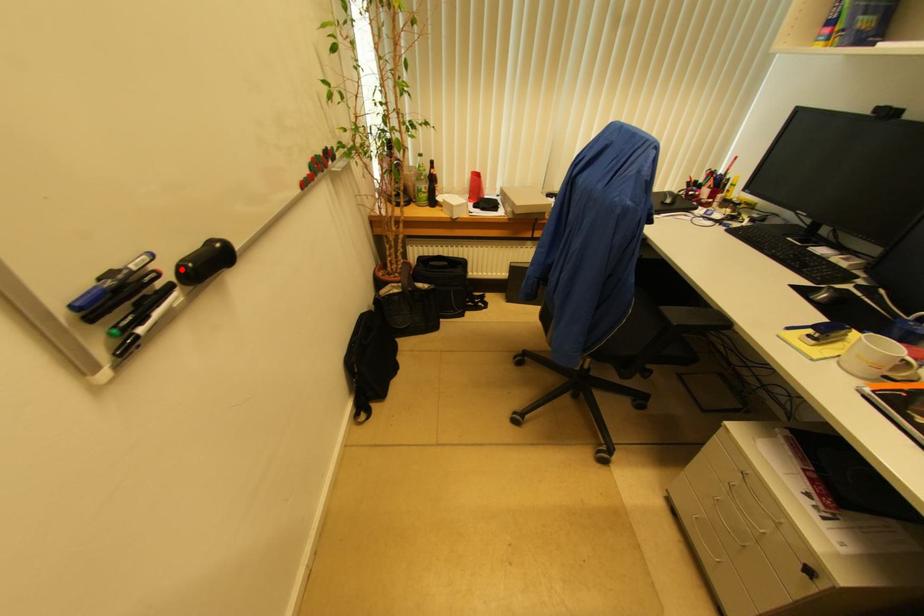
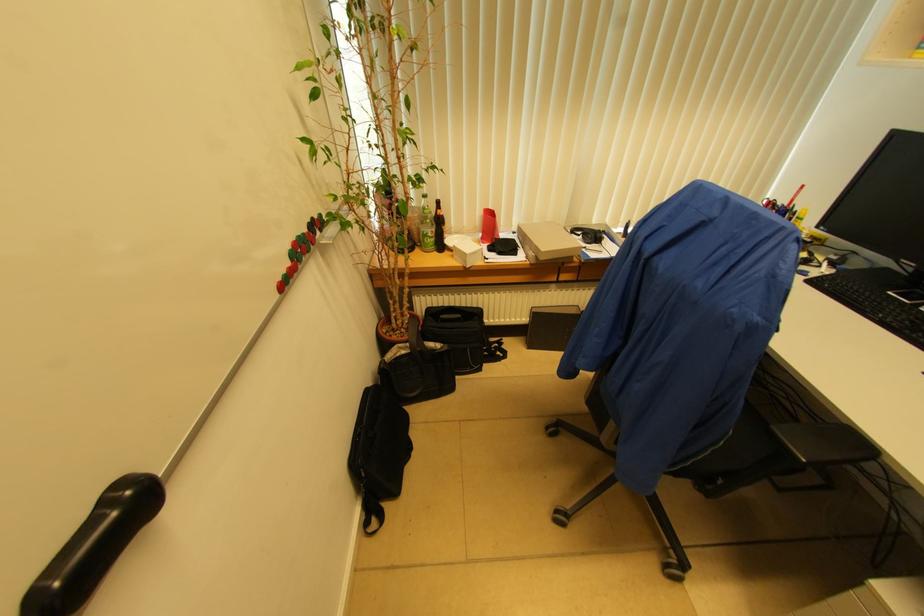
Locate, in the second image, the point that corresponds to the highlighted location in the first image.

(35, 600)